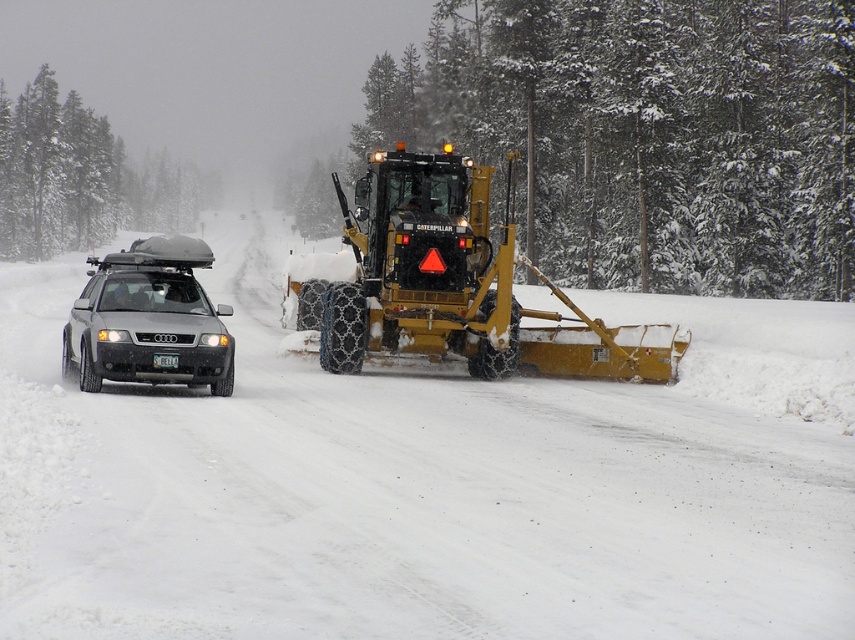
Is white powdery snow at center wider than yellow metallic snowplow at center?

Indeed, white powdery snow at center has a greater width compared to yellow metallic snowplow at center.

Does white powdery snow at center come in front of yellow metallic snowplow at center?

Yes, it is.

Find the location of a particular element. The width and height of the screenshot is (855, 640). white powdery snow at center is located at coordinates (428, 483).

Where is `white powdery snow at center`? white powdery snow at center is located at coordinates (428, 483).

Is white powdery snow at center thinner than matte black car at left?

No.

Is white powdery snow at center below matte black car at left?

No.

Is point (529, 616) farther from camera compared to point (156, 278)?

No, (529, 616) is closer to viewer.

At what (x,y) coordinates should I click in order to perform the action: click on white powdery snow at center. Please return your answer as a coordinate pair (x, y). This screenshot has width=855, height=640. Looking at the image, I should click on (428, 483).

Describe the element at coordinates (428, 483) in the screenshot. The image size is (855, 640). I see `white powdery snow at center` at that location.

Can you confirm if white powdery snow at center is bigger than white plastic license plate at center?

Indeed, white powdery snow at center has a larger size compared to white plastic license plate at center.

Is point (27, 417) closer to viewer compared to point (156, 358)?

Yes, it is in front of point (156, 358).

I want to click on white powdery snow at center, so click(x=428, y=483).